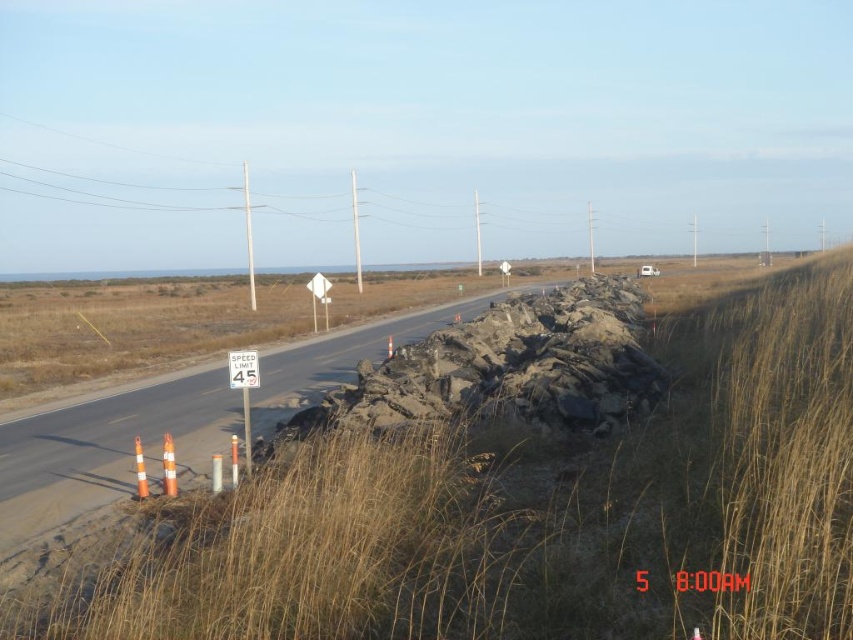
Does point (96, 595) lie in front of point (248, 461)?

Yes, point (96, 595) is in front of point (248, 461).

Can you confirm if brown dry grass at center is thinner than white plastic speed limit sign at center?

In fact, brown dry grass at center might be wider than white plastic speed limit sign at center.

Is point (387, 531) behind point (239, 378)?

That is False.

Identify the location of brown dry grass at center. (531, 513).

Who is positioned more to the right, white plastic speed limit sign at center or metal speed limit sign at center?

From the viewer's perspective, metal speed limit sign at center appears more on the right side.

Locate an element on the screen. white plastic speed limit sign at center is located at coordinates (244, 388).

Where is `white plastic speed limit sign at center`? The height and width of the screenshot is (640, 853). white plastic speed limit sign at center is located at coordinates (244, 388).

Who is lower down, brown dry grass at center or metal speed limit sign at center?

Positioned lower is brown dry grass at center.

Between point (570, 611) and point (248, 353), which one is positioned in front?

Point (570, 611) is more forward.

Is point (123, 620) more distant than point (251, 381)?

That is False.

Locate an element on the screen. The image size is (853, 640). brown dry grass at center is located at coordinates (531, 513).